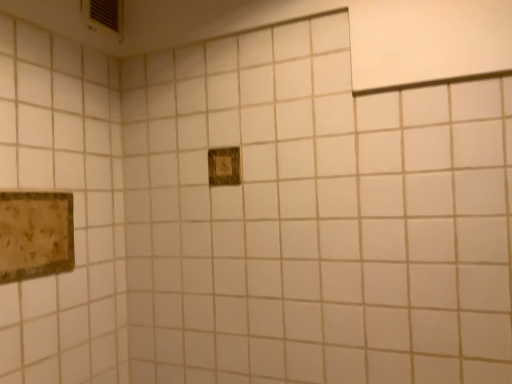
Question: Relative to wooden plaque at center, the second picture frame when ordered from bottom to top, is rustic wood picture frame at lower left, which is the 1th picture frame in front-to-back order, in front or behind?

Choices:
 (A) front
 (B) behind

Answer: (A)

Question: In terms of height, does rustic wood picture frame at lower left, which appears as the first picture frame when ordered from the bottom, look taller or shorter compared to wooden plaque at center, placed as the 2th picture frame when sorted from front to back?

Choices:
 (A) short
 (B) tall

Answer: (B)

Question: From a real-world perspective, is rustic wood picture frame at lower left, the second picture frame from the top, physically located above or below wooden plaque at center, the first picture frame when ordered from top to bottom?

Choices:
 (A) above
 (B) below

Answer: (B)

Question: From their relative heights in the image, would you say wooden plaque at center, the first picture frame when ordered from top to bottom, is taller or shorter than rustic wood picture frame at lower left, which appears as the first picture frame when ordered from the bottom?

Choices:
 (A) short
 (B) tall

Answer: (A)

Question: Based on their positions, is wooden plaque at center, the first picture frame when ordered from top to bottom, located to the left or right of rustic wood picture frame at lower left, which is the 2th picture frame in right-to-left order?

Choices:
 (A) right
 (B) left

Answer: (A)

Question: Choose the correct answer: Is wooden plaque at center, the first picture frame when ordered from top to bottom, inside rustic wood picture frame at lower left, which appears as the first picture frame when ordered from the bottom, or outside it?

Choices:
 (A) inside
 (B) outside

Answer: (B)

Question: Considering the positions of point (237, 160) and point (70, 205), is point (237, 160) closer or farther from the camera than point (70, 205)?

Choices:
 (A) closer
 (B) farther

Answer: (B)